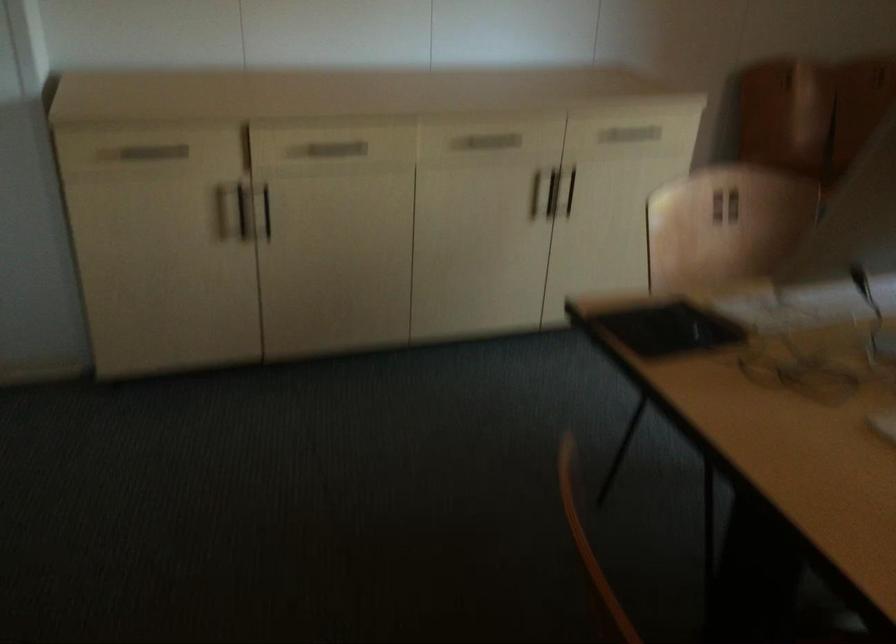
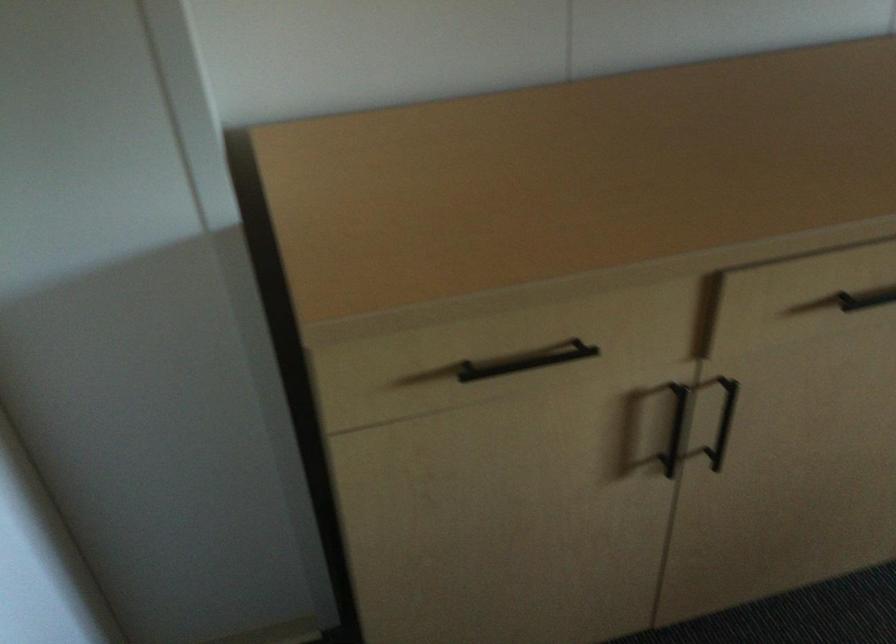
In the second image, find the point that corresponds to point 152,152 in the first image.

(526, 361)